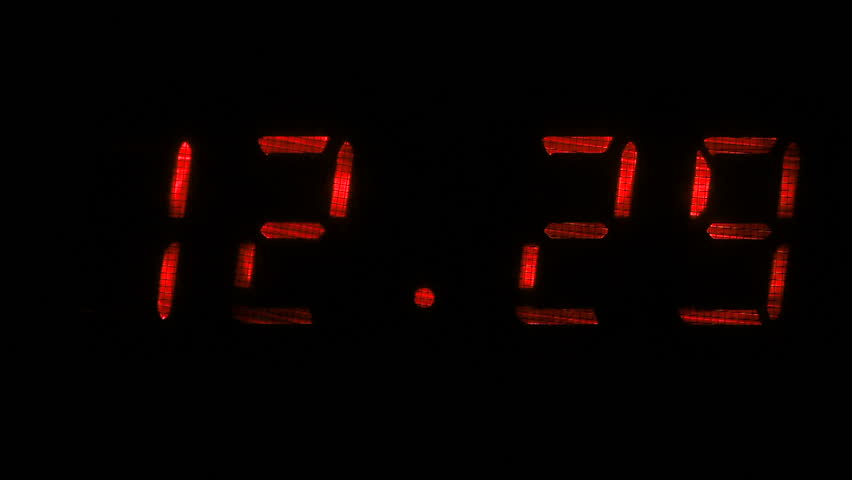
Where is `clock`? The image size is (852, 480). clock is located at coordinates (309, 401).